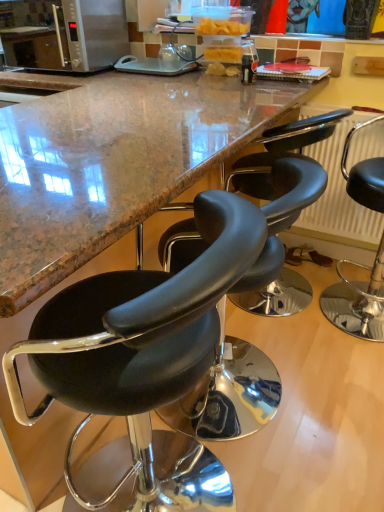
Question: Looking at their shapes, would you say black leather stool at center, the second chair from the left, is wider or thinner than metallic radiator at right?

Choices:
 (A) wide
 (B) thin

Answer: (A)

Question: In the image, is black leather stool at center, the second chair from the left, positioned in front of or behind metallic radiator at right?

Choices:
 (A) front
 (B) behind

Answer: (A)

Question: Which object is positioned farthest from the black leather stool at right, which is counted as the 3th chair, starting from the left?

Choices:
 (A) metallic radiator at right
 (B) satin silver microwave at upper left
 (C) black leather stool at center, marked as the 3th chair in a right-to-left arrangement
 (D) black leather stool at center, the second chair from the left

Answer: (B)

Question: Which of these objects is positioned farthest from the black leather stool at center, which is the first chair from left to right?

Choices:
 (A) black leather stool at center, marked as the 2th chair in a right-to-left arrangement
 (B) black leather stool at right, which is counted as the first chair, starting from the right
 (C) satin silver microwave at upper left
 (D) metallic radiator at right

Answer: (C)